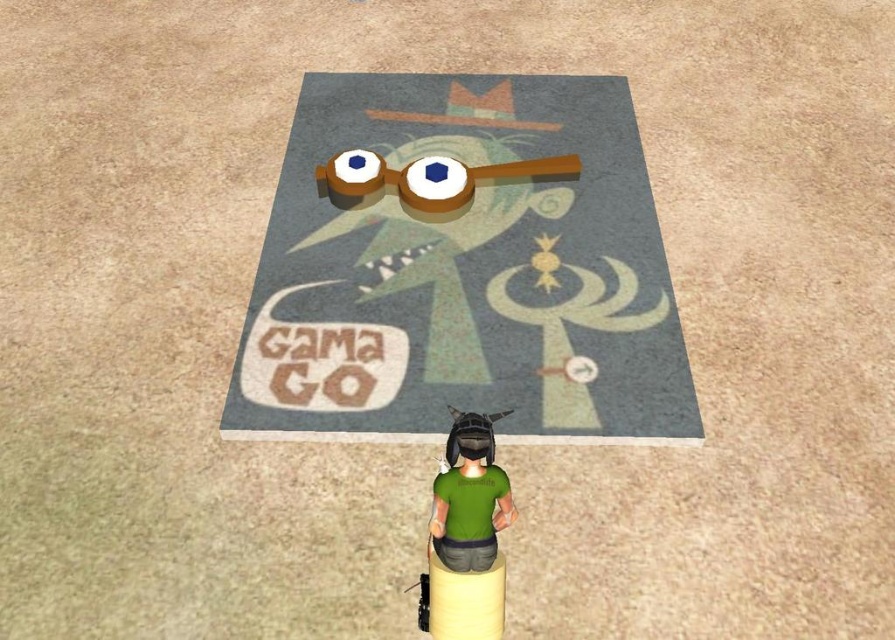
In the scene shown: Is matte green carpet at center to the left of green matte shirt at lower center from the viewer's perspective?

Incorrect, matte green carpet at center is not on the left side of green matte shirt at lower center.

Which is below, matte green carpet at center or green matte shirt at lower center?

green matte shirt at lower center is below.

Where is `matte green carpet at center`? matte green carpet at center is located at coordinates (462, 268).

Where is `matte green carpet at center`? matte green carpet at center is located at coordinates (462, 268).